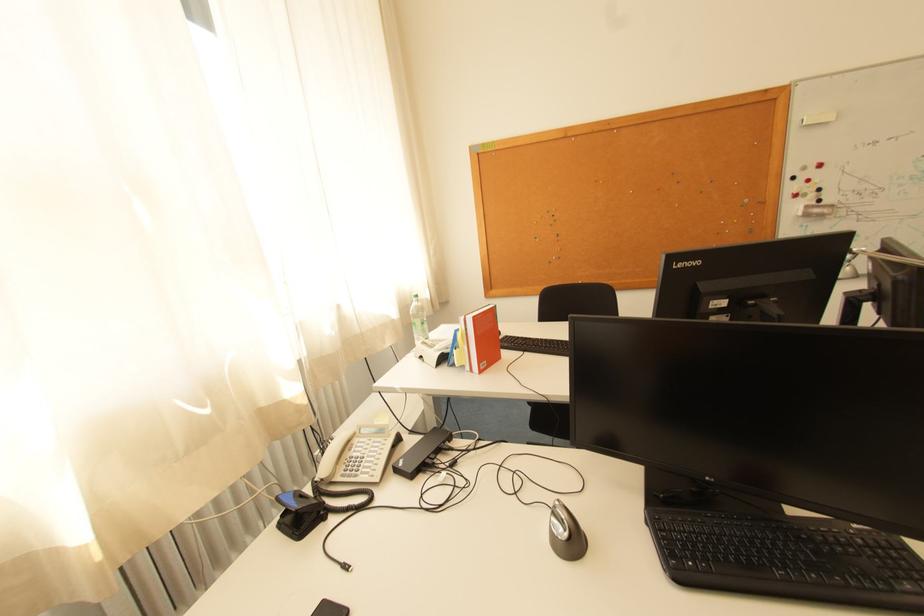
Image resolution: width=924 pixels, height=616 pixels. Describe the element at coordinates (788, 557) in the screenshot. I see `the black keyboard keys` at that location.